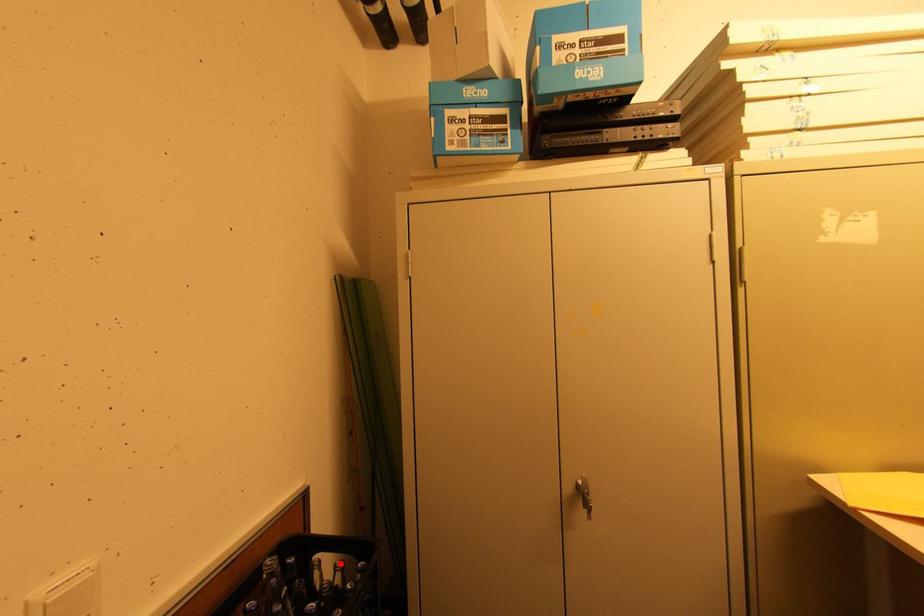
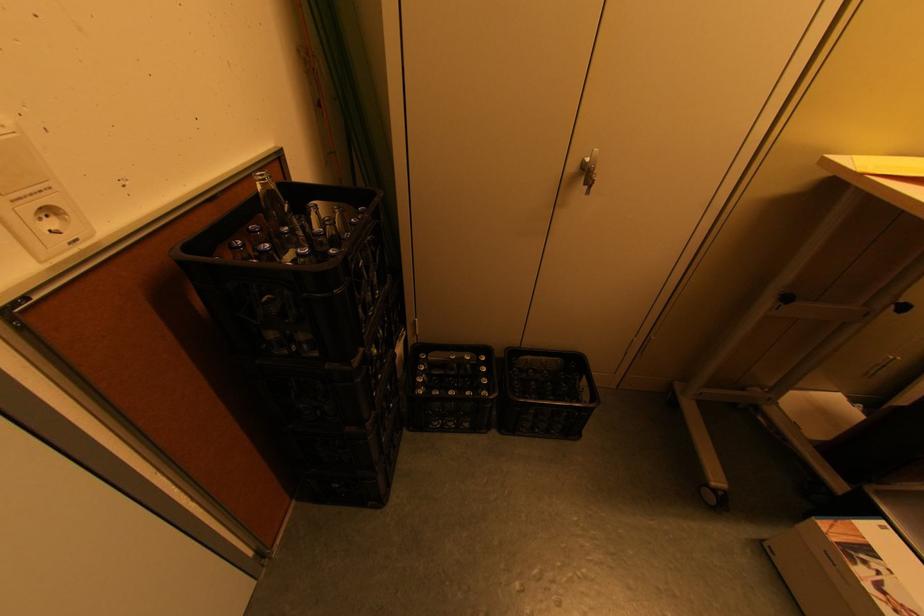
Find the pixel in the second image that matches the highlighted location in the first image.

(338, 208)